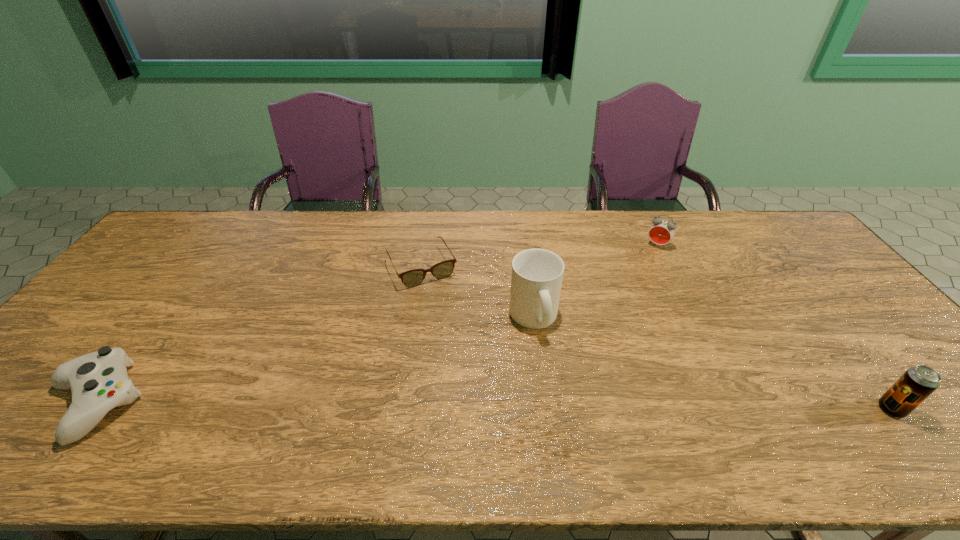
Locate an element on the screen. Image resolution: width=960 pixels, height=540 pixels. vacant point at the near left corner is located at coordinates (35, 387).

I want to click on free point between the leftmost object and the second object from right to left, so click(376, 323).

Identify the location of empty space that is in between the spectacles and the beer can. This screenshot has width=960, height=540. (657, 339).

Locate an element on the screen. This screenshot has width=960, height=540. empty space that is in between the third object from right to left and the shortest object is located at coordinates (478, 293).

The width and height of the screenshot is (960, 540). I want to click on free space between the rightmost object and the tallest object, so click(x=712, y=363).

Locate an element on the screen. vacant region between the tallest object and the second shortest object is located at coordinates (314, 360).

Find the location of a particular element. The height and width of the screenshot is (540, 960). free space between the rightmost object and the second object from right to left is located at coordinates (775, 327).

Locate an element on the screen. free space between the control and the tallest object is located at coordinates (314, 360).

Identify the location of free space between the rightmost object and the alarm clock. (775, 327).

I want to click on free spot between the rightmost object and the second shortest object, so pos(492,406).